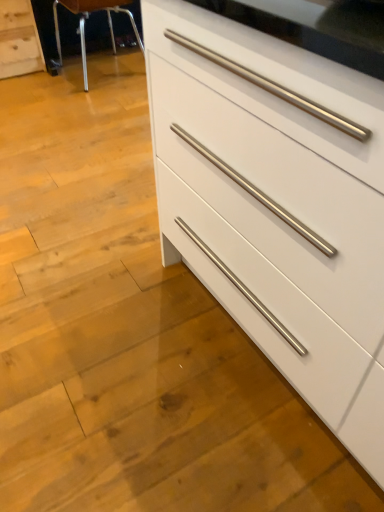
Find the location of a particular element. This screenshot has width=384, height=512. free space to the left of white glossy chest of drawers at center, the first chest of drawers from the bottom is located at coordinates (104, 321).